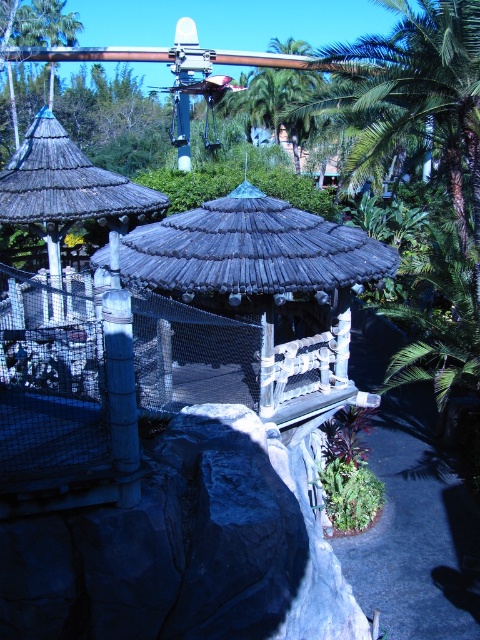
You are a visitor at the zoo and want to take a photo of the wooden thatched roof gazebo at center and the smooth bamboo pole at center. Which object will appear taller in your photo?

The smooth bamboo pole at center will appear taller in your photo because it is taller than the wooden thatched roof gazebo at center.

You are standing in front of the two thatched structures in the tropical outdoor setting. You notice two points marked in the scene. The first point is at coordinates point (299, 413) and the second is at point (112, 300). If you were to walk towards the structures, which point would you encounter first?

Point (112, 300) would be encountered first because it is closer to the viewer compared to point (299, 413), which is further away.